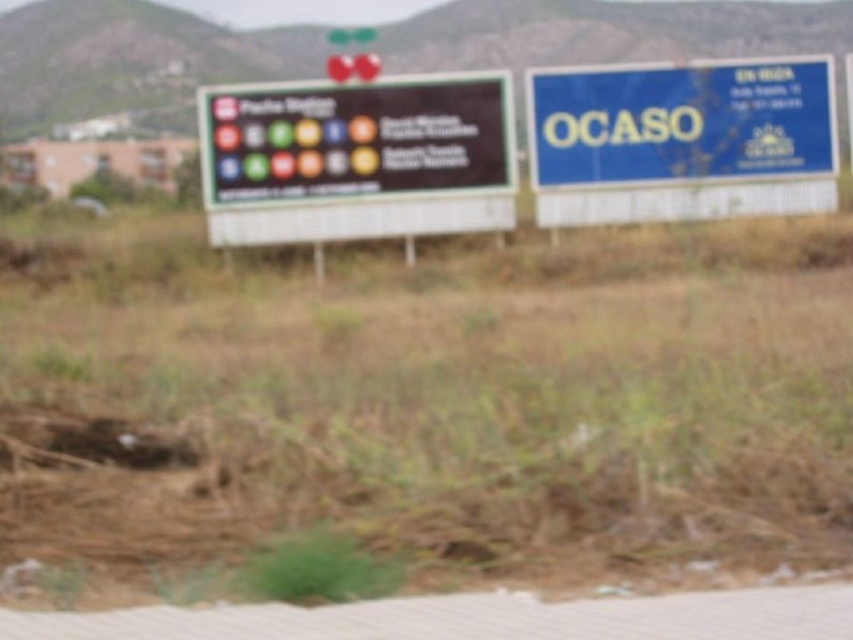
Which is more to the left, black matte sign at center or blue plastic signboard at upper right?

black matte sign at center

Based on the photo, which of these two, black matte sign at center or blue plastic signboard at upper right, stands taller?

blue plastic signboard at upper right

Which is behind, point (366, 131) or point (704, 76)?

The point (704, 76) is behind.

What are the coordinates of `black matte sign at center` in the screenshot? It's located at (357, 138).